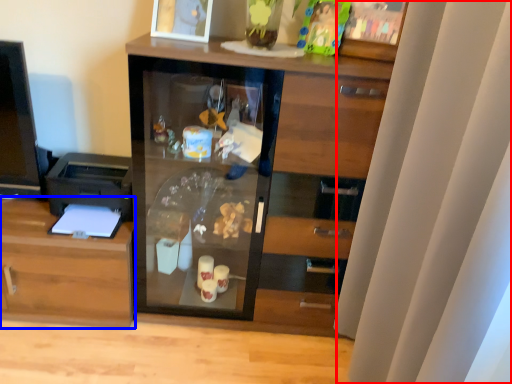
Question: Which point is closer to the camera, curtain (highlighted by a red box) or cabinetry (highlighted by a blue box)?

Choices:
 (A) curtain
 (B) cabinetry

Answer: (A)